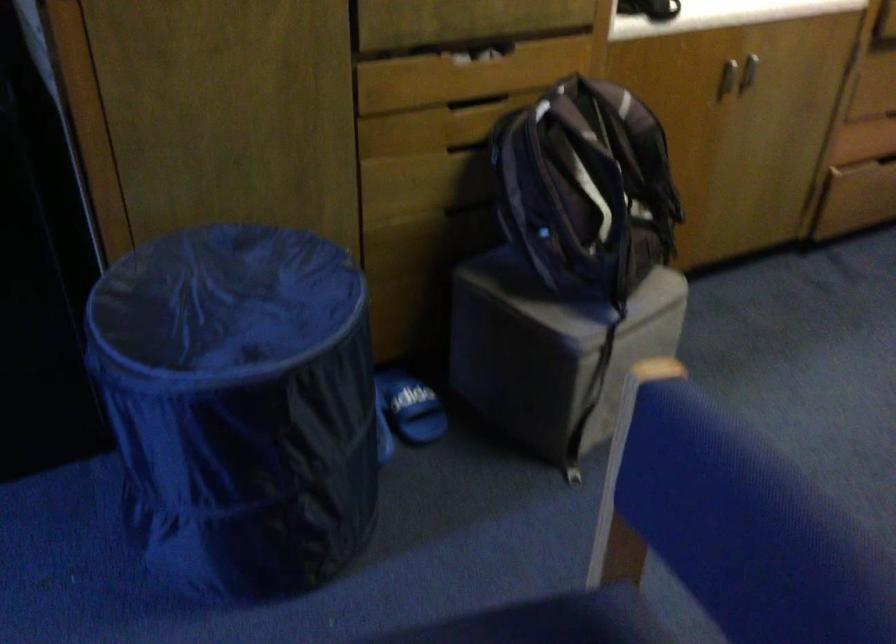
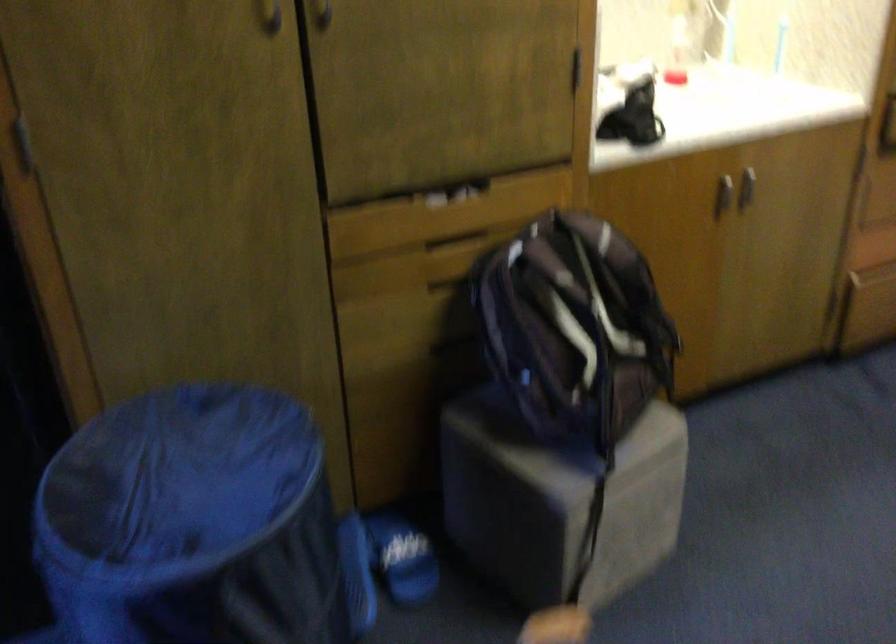
The point at (411, 406) is marked in the first image. Where is the corresponding point in the second image?

(401, 558)